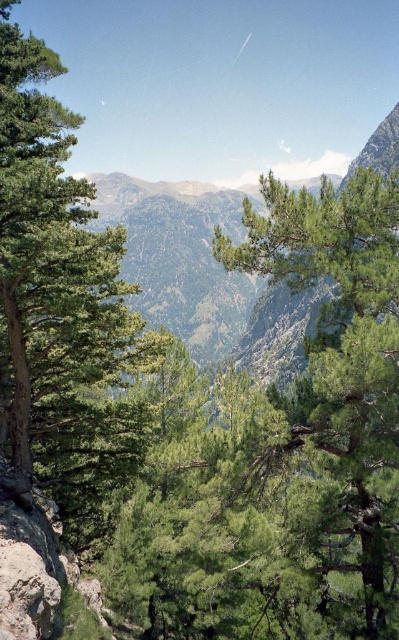
You are standing at the base of the mountain in the scene and want to hike towards the two points marked in the image. Which point, point (331, 426) or point (41, 324), is closer to you?

Point (331, 426) is closer to the viewer than point (41, 324).

You are a hiker standing at the base of the green leafy tree at left and want to reach the green leafy tree at center. Which direction should you move to get there?

The green leafy tree at center is located below the green leafy tree at left, so you should move downward to reach it.

You are an artist planning to paint this mountain landscape. You want to place a small cabin in your painting such that it is positioned exactly at the center of the image. However, you must ensure that the cabin does not overlap with the green leafy tree at center. Given the tree is located at coordinates 0.594, 0.852, can you determine if the cabin will overlap with the tree if placed at the true center of the image?

The green leafy tree at center is located at coordinates (339, 380). The true center of the image would be at coordinates (199, 320). Since the tree is at (339, 380), placing the cabin at (199, 320) would not overlap with the tree as they are at different coordinates.